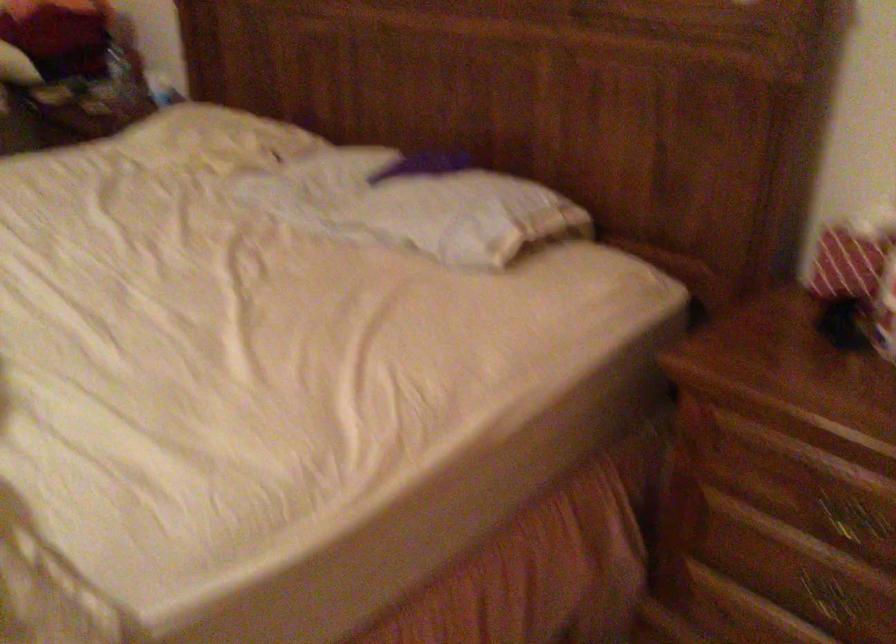
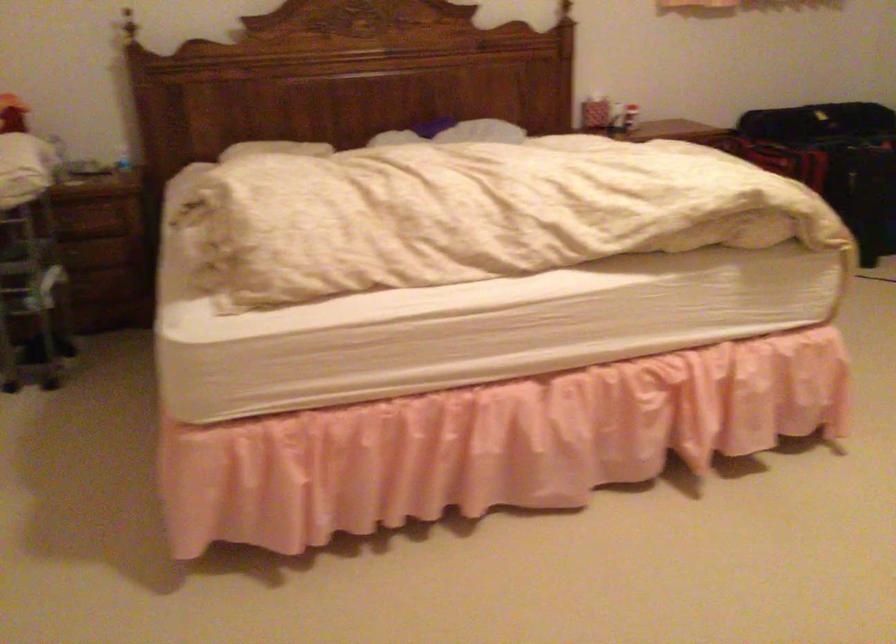
Find the pixel in the second image that matches pixel 787 297 in the first image.

(590, 109)